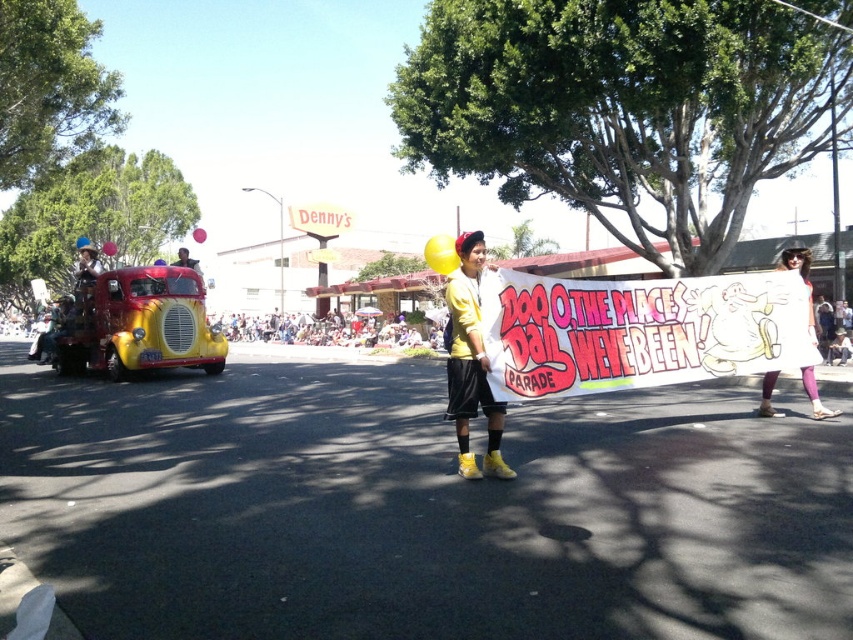
Between yellow matte shirt at center and white fabric dress at center, which one has less height?

With less height is white fabric dress at center.

Who is more distant from viewer, [457,376] or [778,412]?

The point [778,412] is behind.

Locate an element on the screen. The height and width of the screenshot is (640, 853). yellow matte shirt at center is located at coordinates (469, 362).